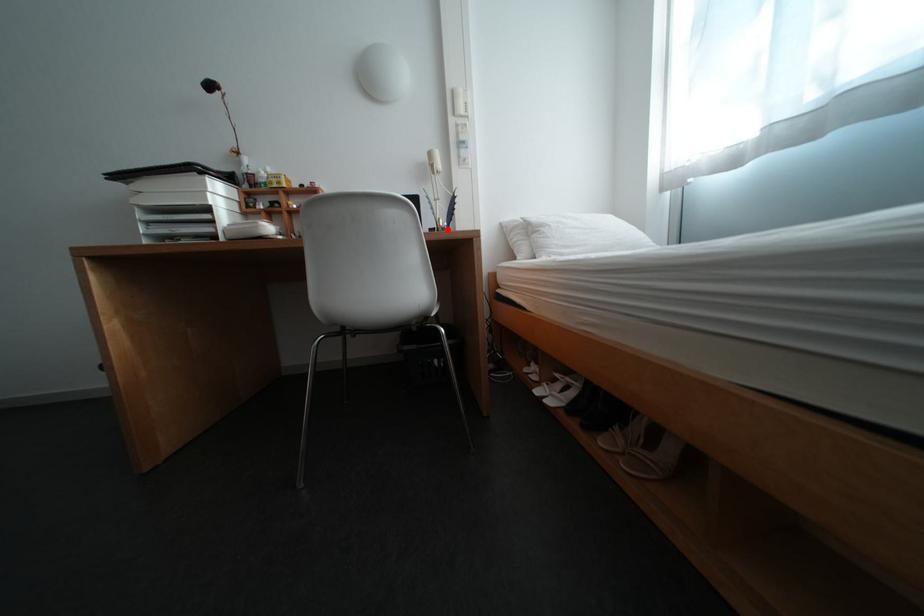
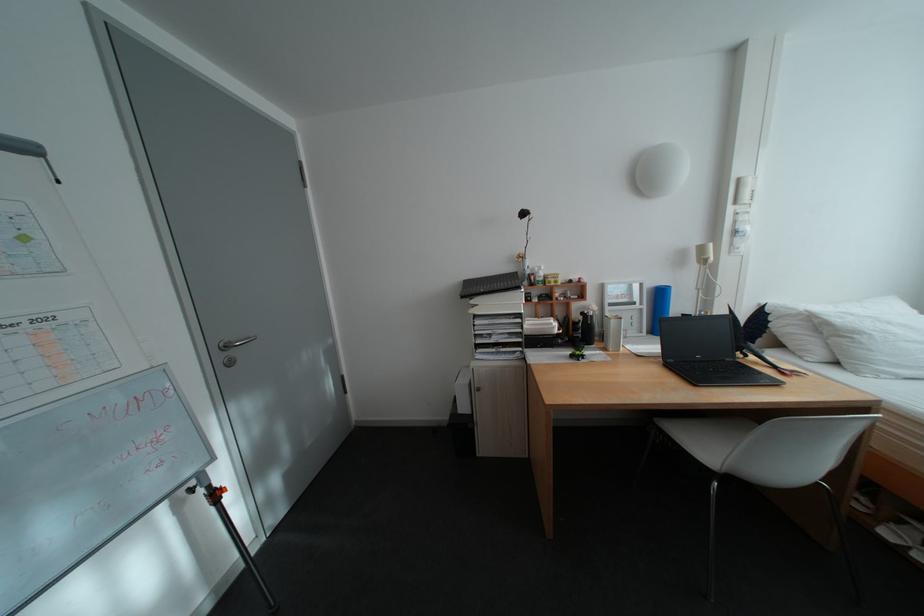
In the second image, find the point that corresponds to the highlighted location in the first image.

(703, 315)